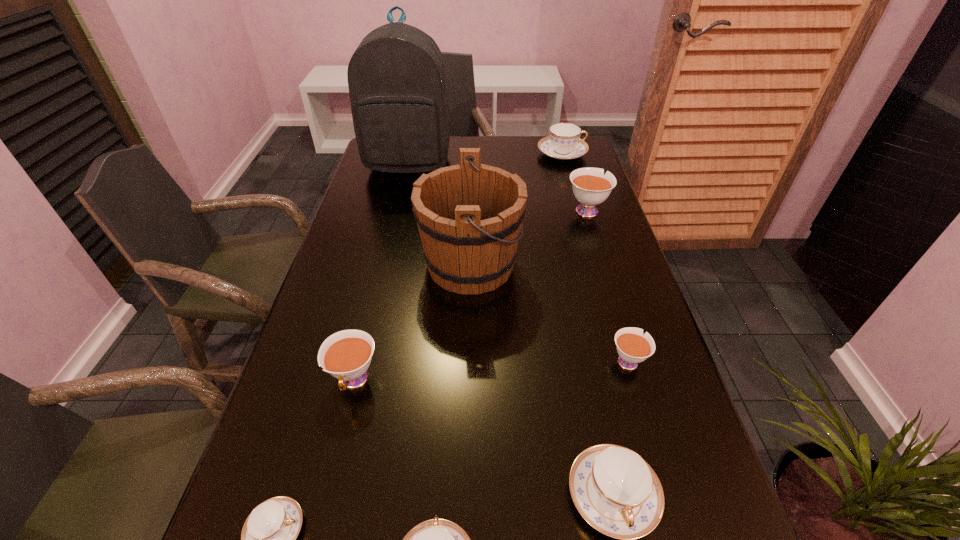
At what (x,y) coordinates should I click in order to perform the action: click on backpack. Please return your answer as a coordinate pair (x, y). This screenshot has height=540, width=960. Looking at the image, I should click on (396, 77).

This screenshot has height=540, width=960. I want to click on the tallest object, so click(x=396, y=77).

Find the location of a particular element. This screenshot has height=540, width=960. the sixth nearest object is located at coordinates click(469, 216).

Find the location of a particular element. The height and width of the screenshot is (540, 960). the second tallest object is located at coordinates (469, 216).

This screenshot has width=960, height=540. Find the location of `the tallest teacup`. the tallest teacup is located at coordinates (590, 186).

I want to click on the farthest white teacup, so click(x=590, y=186).

Where is `the biggest blue teacup`? the biggest blue teacup is located at coordinates (564, 143).

Where is `the farthest blue teacup`? The height and width of the screenshot is (540, 960). the farthest blue teacup is located at coordinates (564, 143).

Locate an element on the screen. the leftmost white teacup is located at coordinates (346, 355).

Find the location of a particular element. the smallest white teacup is located at coordinates (633, 347).